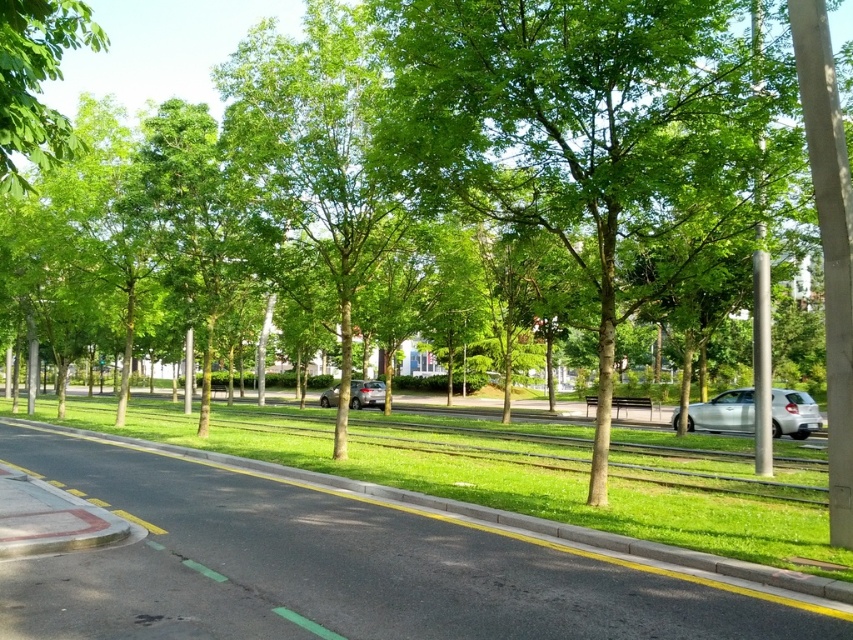
Question: Is green leafy tree at upper left above satin silver sedan at center?

Choices:
 (A) yes
 (B) no

Answer: (A)

Question: Which object appears closest to the camera in this image?

Choices:
 (A) green leafy tree at upper left
 (B) satin silver sedan at center

Answer: (A)

Question: Is silver metallic car at right below satin silver sedan at center?

Choices:
 (A) yes
 (B) no

Answer: (B)

Question: Is green leafy tree at upper left below silver metallic car at right?

Choices:
 (A) no
 (B) yes

Answer: (A)

Question: Among these points, which one is farthest from the camera?

Choices:
 (A) (488, 618)
 (B) (809, 426)
 (C) (25, 76)
 (D) (357, 380)

Answer: (D)

Question: Among these points, which one is farthest from the camera?

Choices:
 (A) (380, 406)
 (B) (7, 168)
 (C) (257, 497)

Answer: (A)